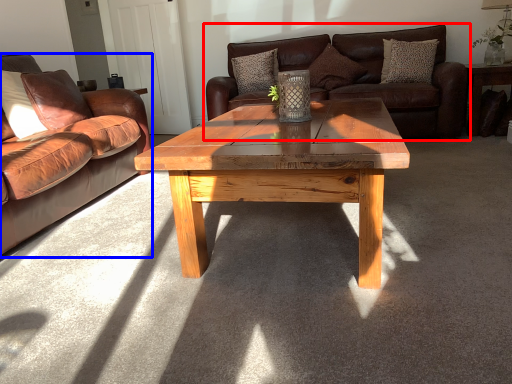
Question: Which point is closer to the camera, studio couch (highlighted by a red box) or studio couch (highlighted by a blue box)?

Choices:
 (A) studio couch
 (B) studio couch

Answer: (B)